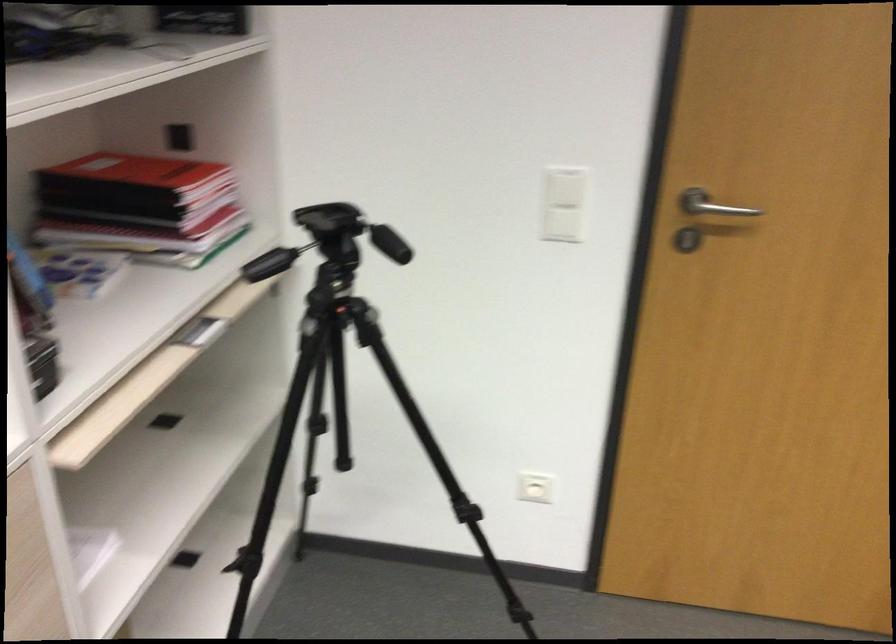
The width and height of the screenshot is (896, 644). What do you see at coordinates (391, 243) in the screenshot? I see `the tripod pan handle` at bounding box center [391, 243].